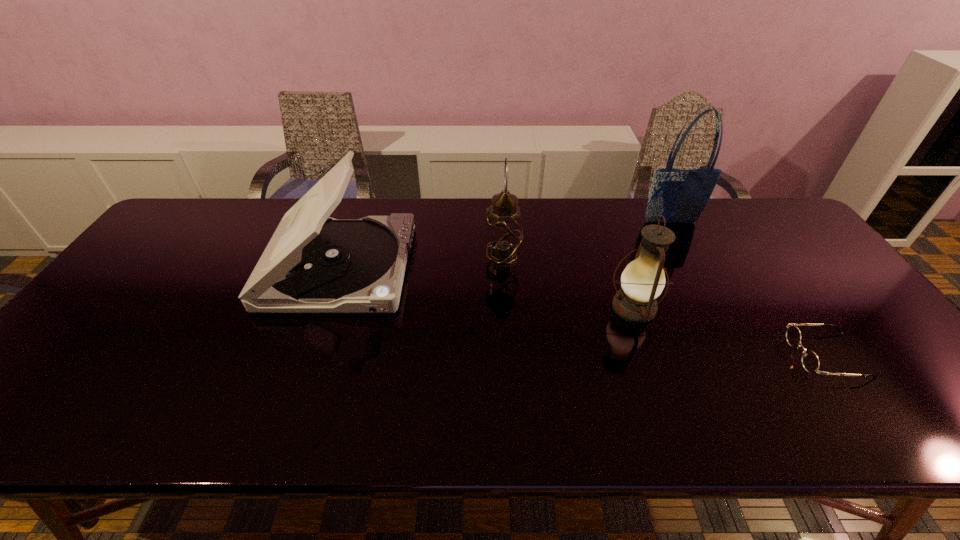
Locate an element on the screen. free space between the leftmost object and the fourth object from right to left is located at coordinates (421, 264).

Identify which object is the fourth closest to the third object from left to right. Please provide its 2D coordinates. Your answer should be formatted as a tuple, i.e. [(x, y)], where the tuple contains the x and y coordinates of a point satisfying the conditions above.

[(313, 263)]

You are a GUI agent. You are given a task and a screenshot of the screen. Output one action in this format:
    pyautogui.click(x=<x>, y=<y>)
    Task: Click on the object that is the fourth closest one to the left oil lamp
    This screenshot has width=960, height=540.
    Given the screenshot: What is the action you would take?
    pyautogui.click(x=810, y=361)

Image resolution: width=960 pixels, height=540 pixels. I want to click on free spot that satisfies the following two spatial constraints: 1. on the front-facing side of the shopping bag; 2. on the control panel of the CD player, so click(x=694, y=267).

You are a GUI agent. You are given a task and a screenshot of the screen. Output one action in this format:
    pyautogui.click(x=<x>, y=<y>)
    Task: Click on the vacant position in the image that satisfies the following two spatial constraints: 1. on the front-facing side of the farthest object; 2. on the control panel of the CD player
    The image size is (960, 540).
    Given the screenshot: What is the action you would take?
    pyautogui.click(x=694, y=267)